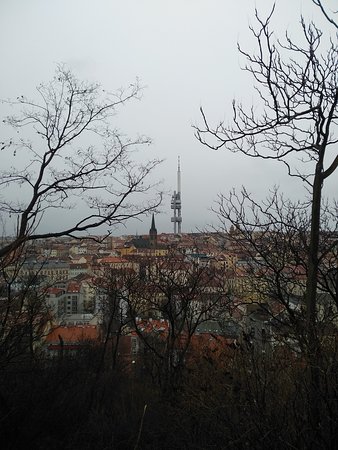
The height and width of the screenshot is (450, 338). Find the location of `window`. window is located at coordinates (67, 308), (69, 301).